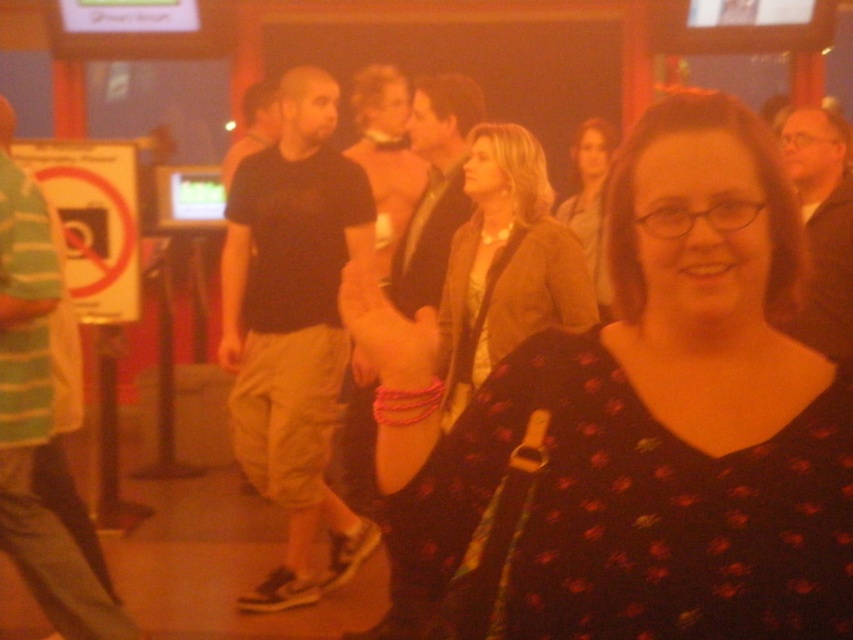
Is green striped shirt at left above matte brown jacket at center?

Actually, green striped shirt at left is below matte brown jacket at center.

Measure the distance between green striped shirt at left and matte brown jacket at center.

The distance of green striped shirt at left from matte brown jacket at center is 2.09 meters.

Is point (103, 586) behind point (572, 202)?

No, (103, 586) is in front of (572, 202).

The height and width of the screenshot is (640, 853). I want to click on green striped shirt at left, so click(x=42, y=420).

Between point (315, 74) and point (41, 321), which one is positioned in front?

Point (41, 321) is in front.

Does point (239, 250) come behind point (32, 396)?

Yes, it is behind point (32, 396).

Is point (262, 161) closer to camera compared to point (68, 353)?

No, (262, 161) is further to viewer.

Locate an element on the screen. black cotton t-shirt at center is located at coordinates (293, 330).

Who is positioned more to the left, green striped shirt at left or dark brown shirt at center?

From the viewer's perspective, green striped shirt at left appears more on the left side.

Between point (47, 241) and point (444, 120), which one is positioned behind?

The point (444, 120) is more distant.

Is point (20, 248) less distant than point (422, 243)?

Yes.

The width and height of the screenshot is (853, 640). Find the location of `green striped shirt at left`. green striped shirt at left is located at coordinates (42, 420).